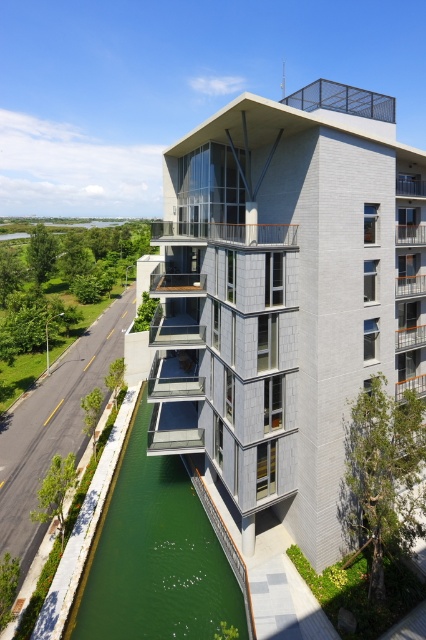
Question: Which object appears closest to the camera in this image?

Choices:
 (A) black metal balcony at upper center
 (B) glassy concrete balcony at upper right
 (C) wooden at center

Answer: (A)

Question: Is glass/transparent balcony at center positioned at the back of glassy concrete balcony at upper right?

Choices:
 (A) no
 (B) yes

Answer: (A)

Question: Is black metal balcony at upper center to the right of wooden at center from the viewer's perspective?

Choices:
 (A) yes
 (B) no

Answer: (A)

Question: Which point is farther to the camera?

Choices:
 (A) black metal balcony at upper center
 (B) wooden at center
 (C) glass/transparent balcony at center

Answer: (B)

Question: Can you confirm if glass/transparent balcony at center is positioned above black metal balcony at upper center?

Choices:
 (A) no
 (B) yes

Answer: (A)

Question: Among these points, which one is farthest from the camera?

Choices:
 (A) (238, 225)
 (B) (183, 288)

Answer: (B)